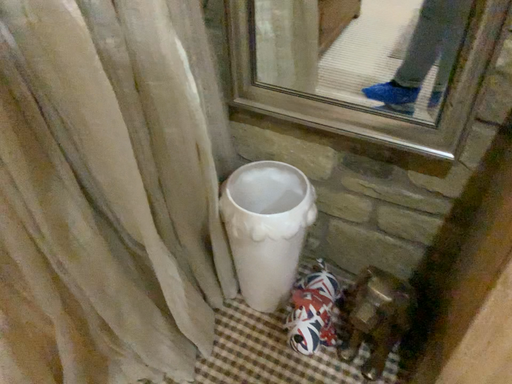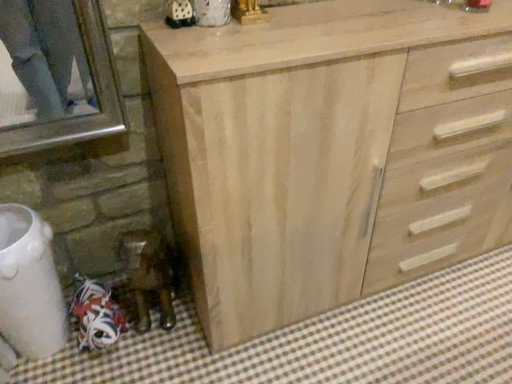
Question: How did the camera likely rotate when shooting the video?

Choices:
 (A) rotated upward
 (B) rotated downward

Answer: (A)